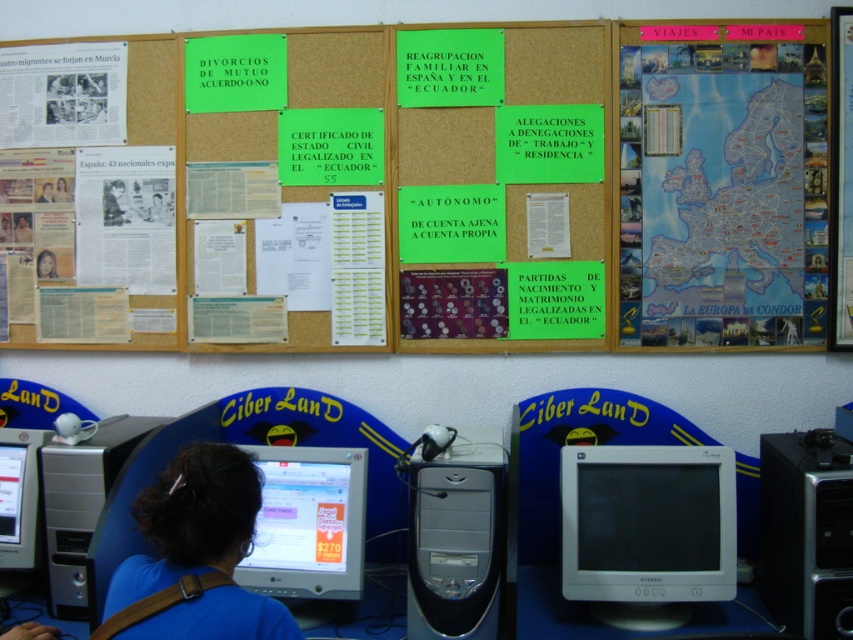
Question: Which point is closer to the camera taking this photo?

Choices:
 (A) (442, 596)
 (B) (584, 582)
 (C) (357, 552)
 (D) (183, 451)

Answer: (A)

Question: Is silver metallic desktop computer at center further to the viewer compared to green paper poster at upper center?

Choices:
 (A) yes
 (B) no

Answer: (B)

Question: Which object appears closest to the camera in this image?

Choices:
 (A) matte silver monitor at lower left
 (B) silver metallic desktop computer at center

Answer: (B)

Question: Which point appears farthest from the camera in this image?

Choices:
 (A) (28, 496)
 (B) (444, 563)

Answer: (A)

Question: Can you confirm if blue laminated map at upper right is smaller than white glossy monitor at center?

Choices:
 (A) no
 (B) yes

Answer: (B)

Question: Is matte black laptop at left to the right of dark brown hair at lower center from the viewer's perspective?

Choices:
 (A) yes
 (B) no

Answer: (B)